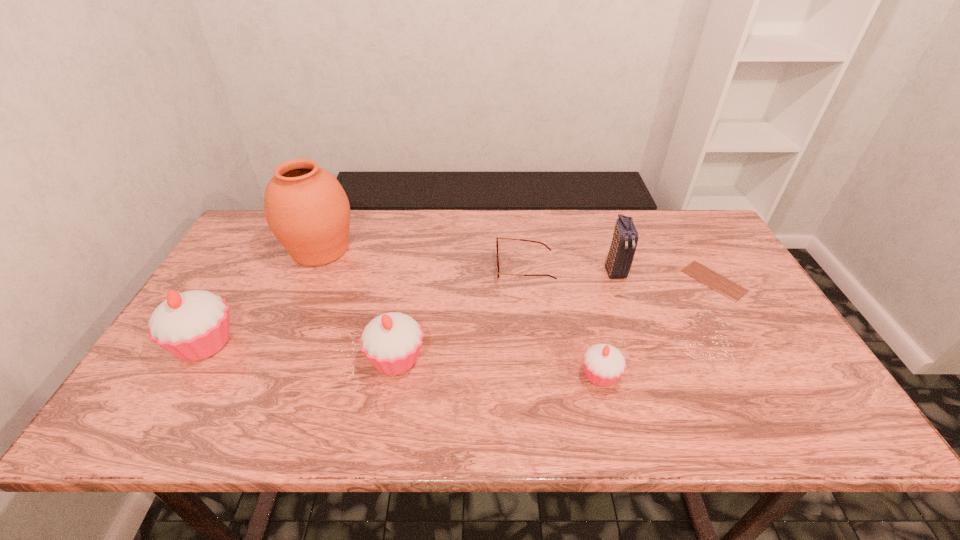
Please show where to add a cupcake on the right while keeping spacing even. Please provide its 2D coordinates. Your answer should be formatted as a tuple, i.e. [(x, y)], where the tuple contains the x and y coordinates of a point satisfying the conditions above.

[(820, 393)]